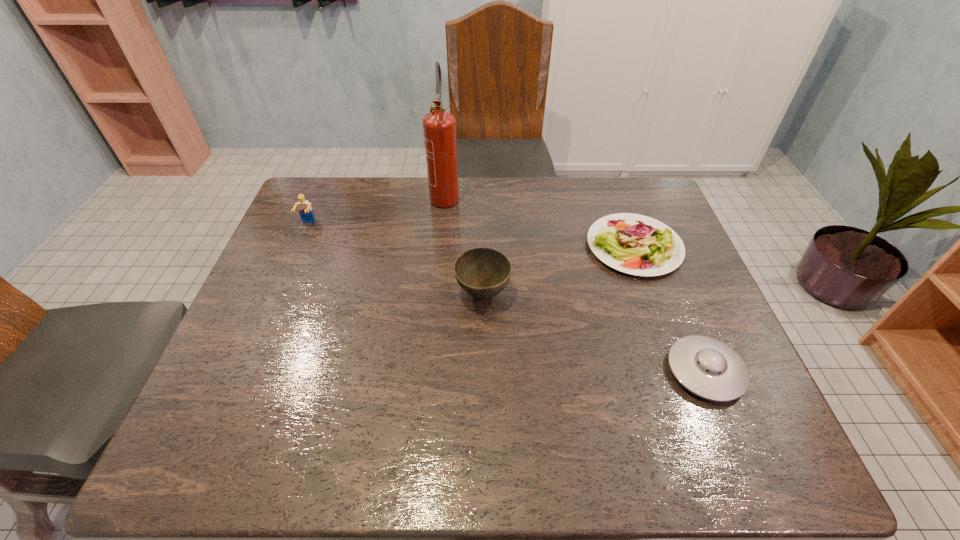
What are the coordinates of `vacant point that satisfies the following two spatial constraints: 1. on the face of the Lego; 2. on the right side of the third object from right to left` in the screenshot? It's located at (278, 294).

Where is `free spot that satisfies the following two spatial constraints: 1. on the back side of the third object from right to left; 2. on the right side of the salad plate`? The width and height of the screenshot is (960, 540). free spot that satisfies the following two spatial constraints: 1. on the back side of the third object from right to left; 2. on the right side of the salad plate is located at coordinates coord(482,247).

You are a GUI agent. You are given a task and a screenshot of the screen. Output one action in this format:
    pyautogui.click(x=<x>, y=<y>)
    Task: Click on the free location that satisfies the following two spatial constraints: 1. on the back side of the salad plate; 2. on the left side of the bowl
    Image resolution: width=960 pixels, height=540 pixels.
    Given the screenshot: What is the action you would take?
    pyautogui.click(x=482, y=247)

Where is `vacant region that satisfies the following two spatial constraints: 1. on the face of the leftmost object; 2. on the left side of the salad plate`? The width and height of the screenshot is (960, 540). vacant region that satisfies the following two spatial constraints: 1. on the face of the leftmost object; 2. on the left side of the salad plate is located at coordinates (299, 247).

Find the location of `vacant region that satisfies the following two spatial constraints: 1. on the face of the leftmost object; 2. on the right side of the salad plate`. vacant region that satisfies the following two spatial constraints: 1. on the face of the leftmost object; 2. on the right side of the salad plate is located at coordinates (299, 247).